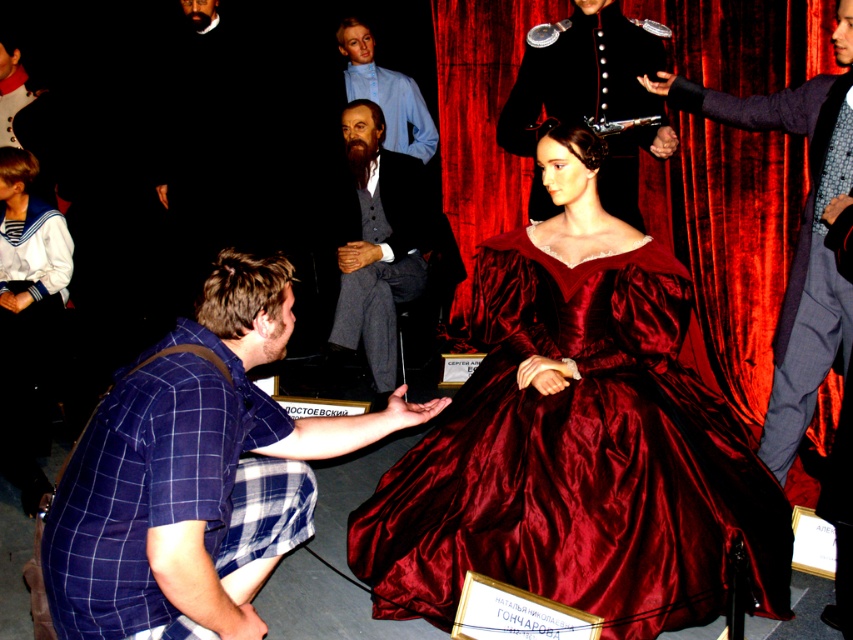
Question: Is velvet suit at right positioned behind shiny black uniform at upper center?

Choices:
 (A) no
 (B) yes

Answer: (A)

Question: Does shiny burgundy gown at center appear on the left side of shiny black uniform at upper center?

Choices:
 (A) no
 (B) yes

Answer: (B)

Question: Based on their relative distances, which object is farther from the shiny black uniform at upper center?

Choices:
 (A) blue plaid shirt at lower left
 (B) smooth gray suit at center
 (C) shiny burgundy gown at center
 (D) velvet suit at right

Answer: (A)

Question: Can you confirm if shiny burgundy gown at center is thinner than blue plaid shirt at lower left?

Choices:
 (A) no
 (B) yes

Answer: (A)

Question: Which object appears closest to the camera in this image?

Choices:
 (A) smooth gray suit at center
 (B) shiny burgundy gown at center
 (C) velvet suit at right
 (D) blue plaid shirt at lower left

Answer: (D)

Question: Estimate the real-world distances between objects in this image. Which object is closer to the smooth gray suit at center?

Choices:
 (A) shiny black uniform at upper center
 (B) velvet suit at right
 (C) shiny burgundy gown at center

Answer: (A)